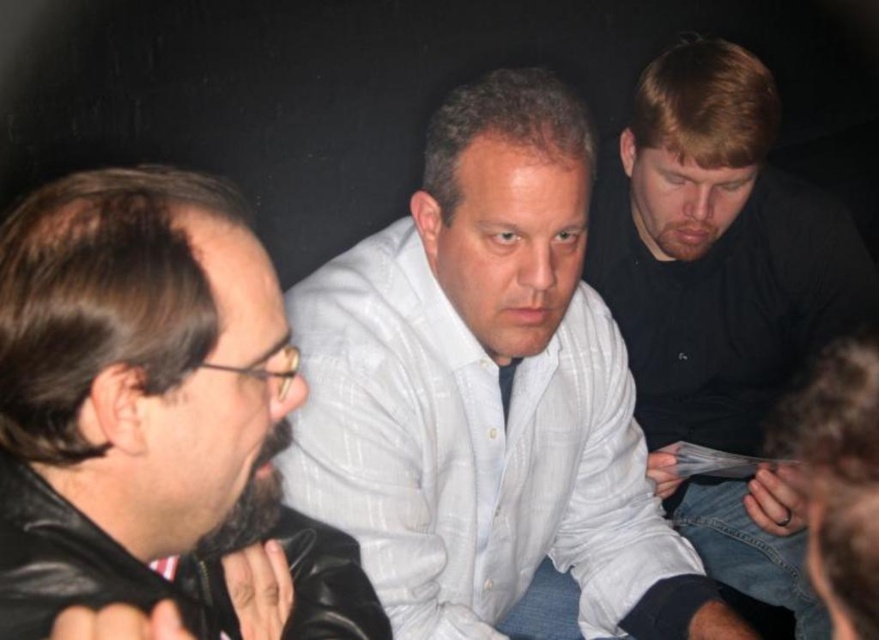
You are standing in the scene and want to greet both the white striped shirt at center and the black leather jacket at left. Which person should you approach first if you want to greet the one closer to your current position?

The black leather jacket at left is closer to your current position, so you should approach the black leather jacket at left first.

You are standing in front of the group and want to point out two specific points in the scene. The first point is at coordinates point (402, 545) and the second point is at point (727, 336). Which of these two points is closer to you?

Point (402, 545) is closer to the camera than point (727, 336), so the first point is closer to you.